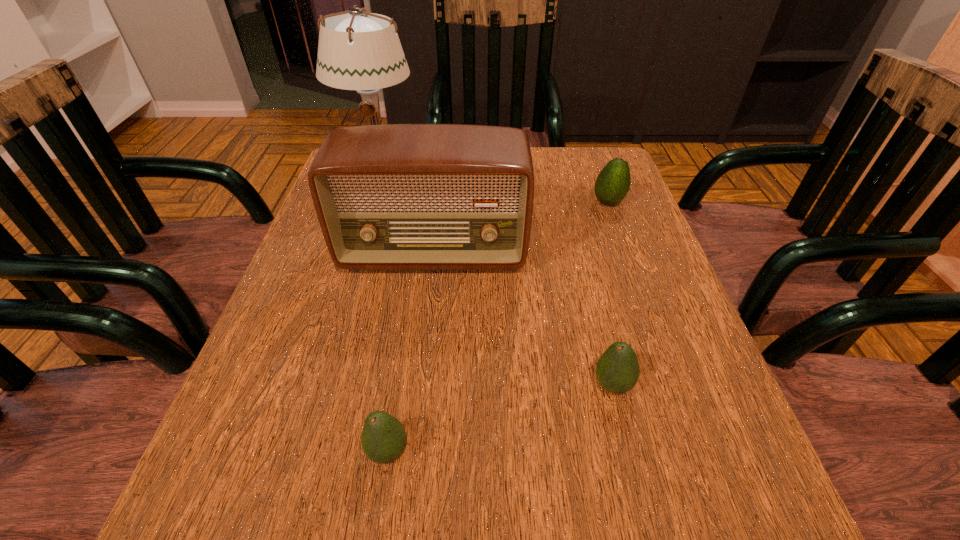
This screenshot has height=540, width=960. Identify the location of free space that is in between the second avocado from left to right and the rightmost avocado. (611, 294).

At what (x,y) coordinates should I click in order to perform the action: click on blank region between the second avocado from left to right and the third farthest object. Please return your answer as a coordinate pair (x, y). The image size is (960, 540). Looking at the image, I should click on (523, 320).

Identify the location of vacant space that's between the nearest avocado and the farthest object. (384, 310).

Image resolution: width=960 pixels, height=540 pixels. Identify the location of free spot between the nearest object and the tallest avocado. (498, 327).

Identify which object is the fourth closest to the lampshade. Please provide its 2D coordinates. Your answer should be formatted as a tuple, i.e. [(x, y)], where the tuple contains the x and y coordinates of a point satisfying the conditions above.

[(384, 438)]

Find the location of a particular element. object that can be found as the fourth closest to the second avocado from left to right is located at coordinates (357, 50).

Identify which avocado is the nearest to the nearest avocado. Please provide its 2D coordinates. Your answer should be formatted as a tuple, i.e. [(x, y)], where the tuple contains the x and y coordinates of a point satisfying the conditions above.

[(617, 371)]

The width and height of the screenshot is (960, 540). In order to click on the third closest avocado relative to the third farthest object in this screenshot , I will do `click(384, 438)`.

At what (x,y) coordinates should I click in order to perform the action: click on free space in the image that satisfies the following two spatial constraints: 1. on the front-facing side of the second avocado from right to left; 2. on the left side of the fourth shortest object. Please return your answer as a coordinate pair (x, y). The height and width of the screenshot is (540, 960). Looking at the image, I should click on (419, 385).

At what (x,y) coordinates should I click in order to perform the action: click on vacant area that satisfies the following two spatial constraints: 1. on the lampshade of the leftmost avocado; 2. on the right side of the tallest object. Please return your answer as a coordinate pair (x, y). The width and height of the screenshot is (960, 540). Looking at the image, I should click on (291, 451).